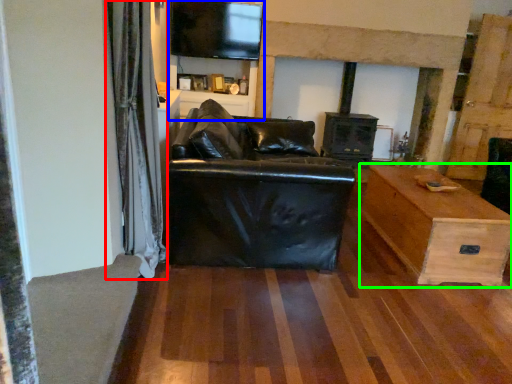
Question: Estimate the real-world distances between objects in this image. Which object is closer to curtain (highlighted by a red box), entertainment center (highlighted by a blue box) or table (highlighted by a green box)?

Choices:
 (A) entertainment center
 (B) table

Answer: (B)